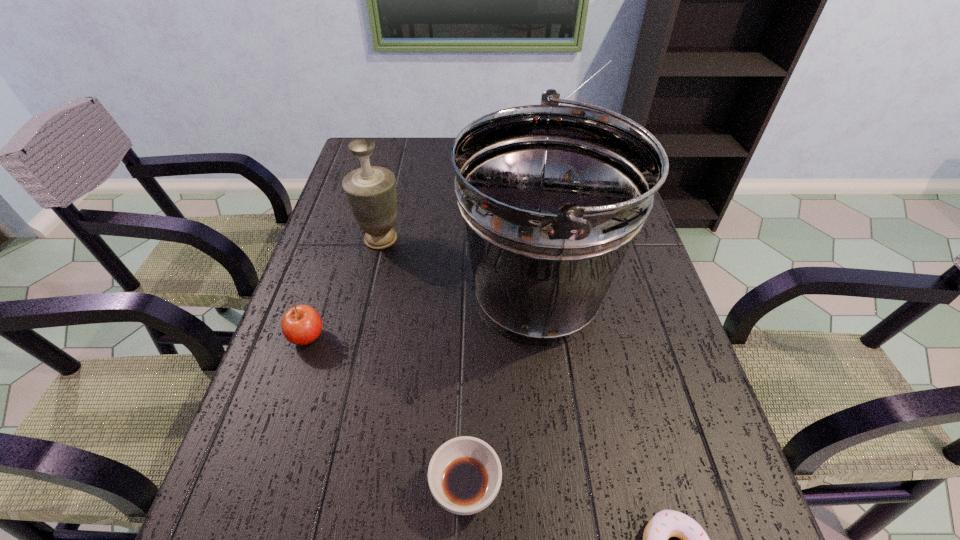
I want to click on vacant space located 0.090m on the back of the soup bowl, so click(x=468, y=407).

This screenshot has height=540, width=960. Find the location of `object located in the far edge section of the desktop`. object located in the far edge section of the desktop is located at coordinates (610, 60).

Identify the location of urn located in the left edge section of the desktop. point(370,191).

At what (x,y) coordinates should I click in order to perform the action: click on apple that is at the left edge. Please return your answer as a coordinate pair (x, y). Image resolution: width=960 pixels, height=540 pixels. Looking at the image, I should click on (301, 325).

Find the location of a particular element. bucket that is positioned at the right edge is located at coordinates (551, 196).

The height and width of the screenshot is (540, 960). What are the coordinates of `radio receiver that is at the right edge` in the screenshot? It's located at (610, 60).

This screenshot has width=960, height=540. Identify the location of object located in the far right corner section of the desktop. (610, 60).

The image size is (960, 540). I want to click on free space at the far edge, so click(411, 148).

Identify the location of blank space at the left edge of the desktop. (313, 253).

In the image, there is a desktop. At what (x,y) coordinates should I click in order to perform the action: click on free space at the right edge. Please return your answer as a coordinate pair (x, y). This screenshot has width=960, height=540. Looking at the image, I should click on (629, 256).